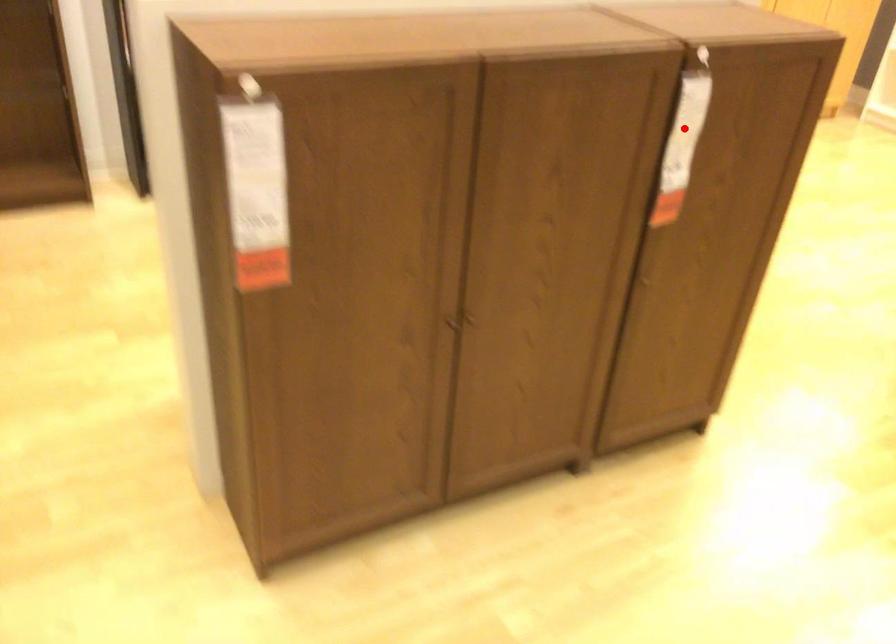
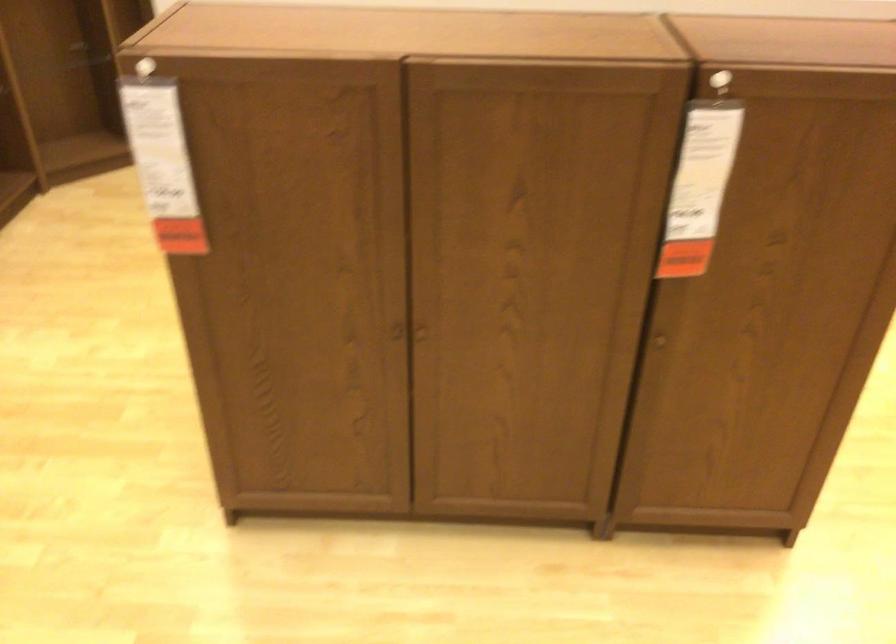
The point at the highlighted location is marked in the first image. Where is the corresponding point in the second image?

(702, 169)